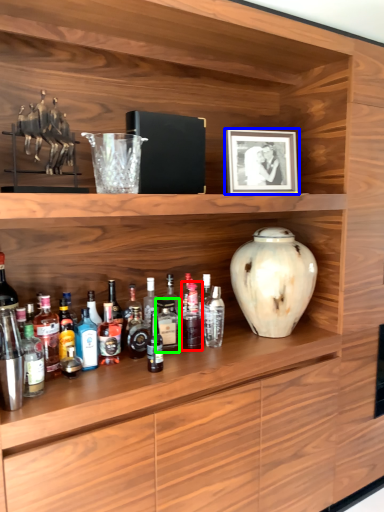
Question: Which is farther away from bottle (highlighted by a red box)? picture frame (highlighted by a blue box) or bottle (highlighted by a green box)?

Choices:
 (A) picture frame
 (B) bottle

Answer: (A)